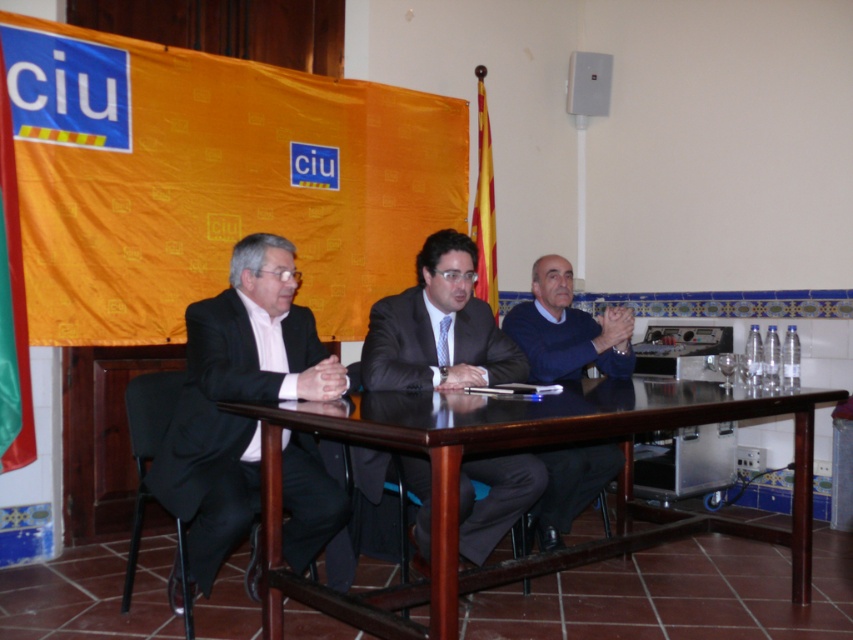
You are attending a virtual meeting and your cursor is at the point with coordinates (438, 326). Which person are you pointing at?

The point at coordinates (438, 326) indicates the matte black suit at center, so you are pointing at the person in the middle wearing a matte black suit.

Consider the image. You are a photographer positioned behind the table in the scene. You need to take a photo of both the matte black suit at center and the dark blue sweater at center. Which one will appear larger in the photo?

The matte black suit at center will appear larger in the photo because it is closer to the viewer than the dark blue sweater at center.

Consider the image. In the meeting scene, there are three people sitting at a table. The first person is wearing a matte black suit at left, the second is wearing a dark suit with a white shirt and tie in the middle, and the third is wearing a dark blue sweater on the right. If you were to draw a line from the center of the table to the matte black suit at left, would it pass through the point marked as point (236,397)?

Yes, the line from the center of the table to the matte black suit at left would pass through point (236,397) because the matte black suit at left is located at that point.